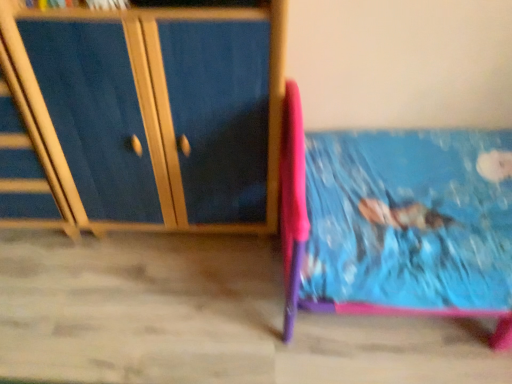
Question: Is blue wood cabinet at left looking in the opposite direction of wooden drawer at left?

Choices:
 (A) no
 (B) yes

Answer: (A)

Question: Can you confirm if blue wood cabinet at left is wider than wooden drawer at left?

Choices:
 (A) no
 (B) yes

Answer: (B)

Question: Can you confirm if blue wood cabinet at left is bigger than wooden drawer at left?

Choices:
 (A) yes
 (B) no

Answer: (A)

Question: Does blue wood cabinet at left come behind wooden drawer at left?

Choices:
 (A) no
 (B) yes

Answer: (A)

Question: Does blue wood cabinet at left have a smaller size compared to wooden drawer at left?

Choices:
 (A) yes
 (B) no

Answer: (B)

Question: Is blue wood cabinet at left placed right next to wooden drawer at left?

Choices:
 (A) no
 (B) yes

Answer: (B)

Question: Is wooden drawer at left further to the viewer compared to blue wood cabinet at left?

Choices:
 (A) yes
 (B) no

Answer: (A)

Question: Is wooden drawer at left far away from blue wood cabinet at left?

Choices:
 (A) no
 (B) yes

Answer: (A)

Question: From a real-world perspective, is wooden drawer at left on top of blue wood cabinet at left?

Choices:
 (A) yes
 (B) no

Answer: (B)

Question: Is wooden drawer at left outside blue wood cabinet at left?

Choices:
 (A) yes
 (B) no

Answer: (A)

Question: Is wooden drawer at left aimed at blue wood cabinet at left?

Choices:
 (A) yes
 (B) no

Answer: (B)

Question: Considering the relative sizes of wooden drawer at left and blue wood cabinet at left in the image provided, is wooden drawer at left bigger than blue wood cabinet at left?

Choices:
 (A) yes
 (B) no

Answer: (B)

Question: Based on their sizes in the image, would you say blue wood cabinet at left is bigger or smaller than wooden drawer at left?

Choices:
 (A) big
 (B) small

Answer: (A)